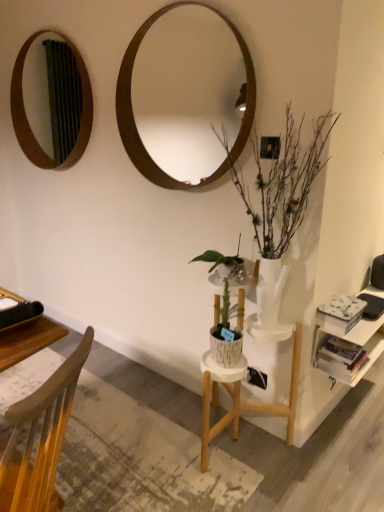
Where is `vacant space underneath white matte book at right, the 2th book ordered from the bottom (from a real-world perspective)`? This screenshot has height=512, width=384. vacant space underneath white matte book at right, the 2th book ordered from the bottom (from a real-world perspective) is located at coordinates (338, 329).